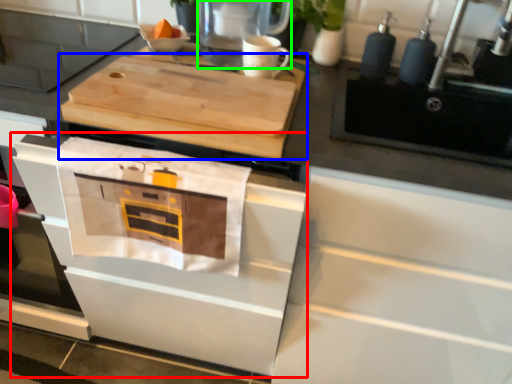
Question: Which is nearer to the oven (highlighted by a red box)? cutting board (highlighted by a blue box) or kitchen appliance (highlighted by a green box).

Choices:
 (A) cutting board
 (B) kitchen appliance

Answer: (A)